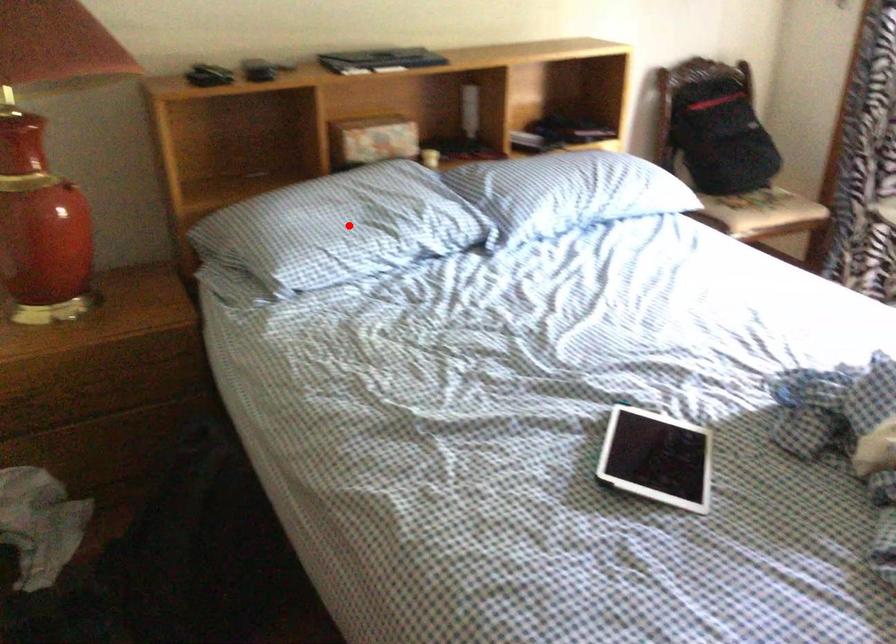
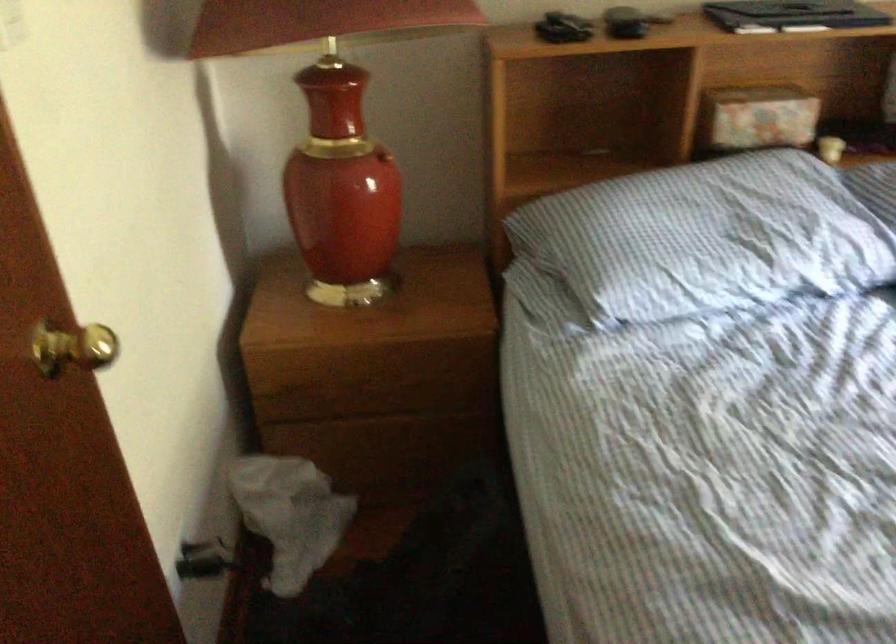
Question: I am providing you with two images of the same scene from different viewpoints. Image1 has a red point marked. In image2, the corresponding 3D location appears at what relative position? Reply with the corresponding letter.

Choices:
 (A) Closer
 (B) Farther

Answer: (A)